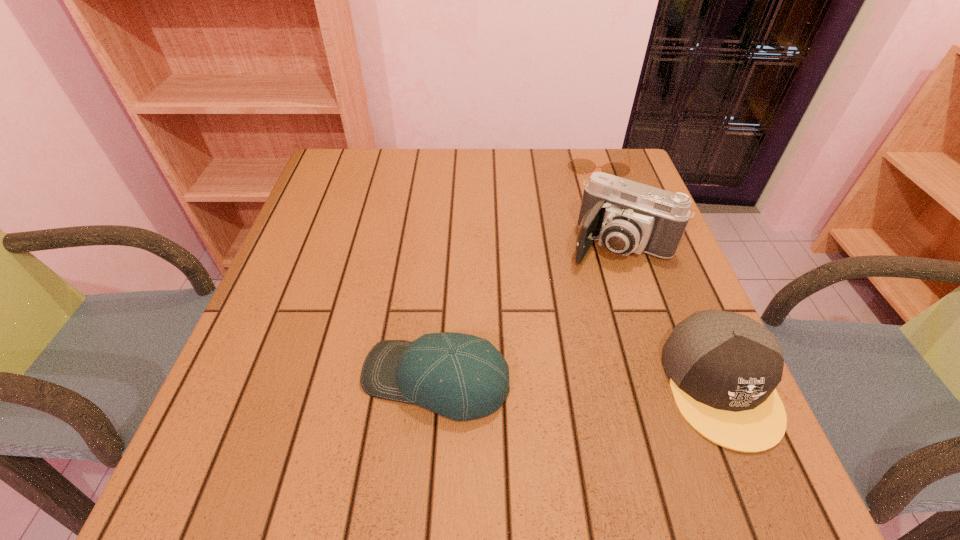
This screenshot has height=540, width=960. Identify the location of the leftmost object. (462, 377).

You are a GUI agent. You are given a task and a screenshot of the screen. Output one action in this format:
    pyautogui.click(x=<x>, y=<y>)
    Task: Click on the cap
    Image resolution: width=960 pixels, height=540 pixels.
    Given the screenshot: What is the action you would take?
    pyautogui.click(x=723, y=367)

I want to click on the farthest object, so click(x=580, y=165).

At what (x,y) coordinates should I click in order to perform the action: click on sunglasses. Please return your answer as a coordinate pair (x, y). The width and height of the screenshot is (960, 540). Looking at the image, I should click on (580, 165).

You are a GUI agent. You are given a task and a screenshot of the screen. Output one action in this format:
    pyautogui.click(x=<x>, y=<y>)
    Task: Click on the tallest object
    The height and width of the screenshot is (540, 960).
    Given the screenshot: What is the action you would take?
    pyautogui.click(x=625, y=216)

At what (x,y) coordinates should I click in order to perform the action: click on the second farthest object. Please return your answer as a coordinate pair (x, y). Looking at the image, I should click on (625, 216).

The height and width of the screenshot is (540, 960). Identify the location of vacant space positioned 0.190m on the left of the baseball cap. tap(255, 380).

What are the coordinates of `free space located 0.170m on the face of the farthest object` in the screenshot? It's located at (594, 216).

I want to click on free spot located 0.100m on the face of the farthest object, so click(x=594, y=200).

At what (x,y) coordinates should I click in order to perform the action: click on free region located on the face of the farthest object. Please return your answer as a coordinate pair (x, y). The width and height of the screenshot is (960, 540). Looking at the image, I should click on (592, 245).